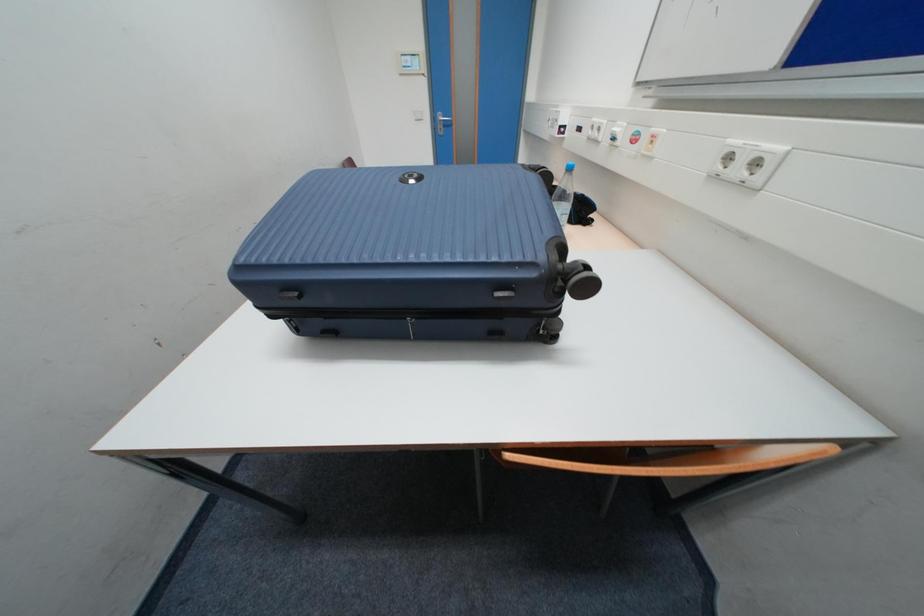
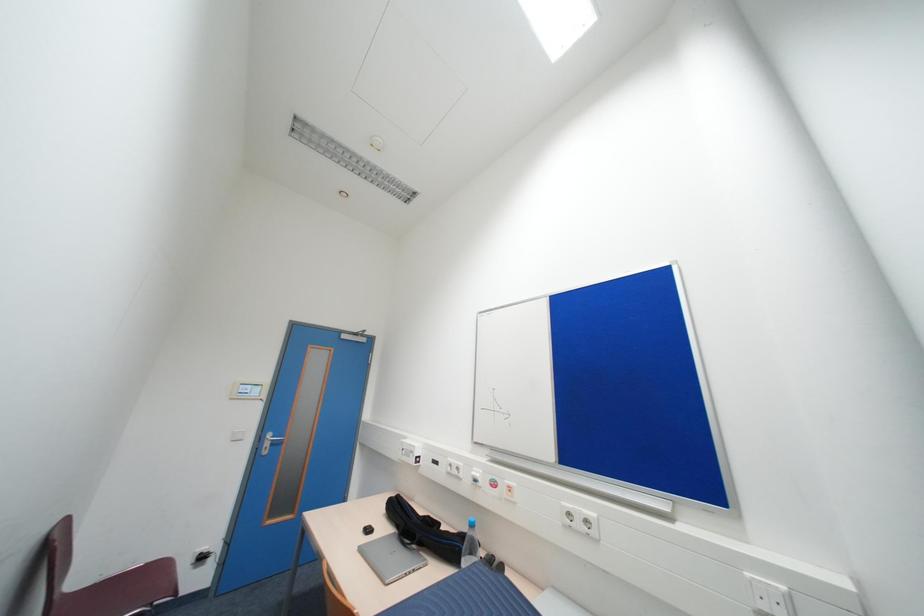
The first image is from the beginning of the video and the second image is from the end. How did the camera likely rotate when shooting the video?

The camera's rotation is toward right-up.